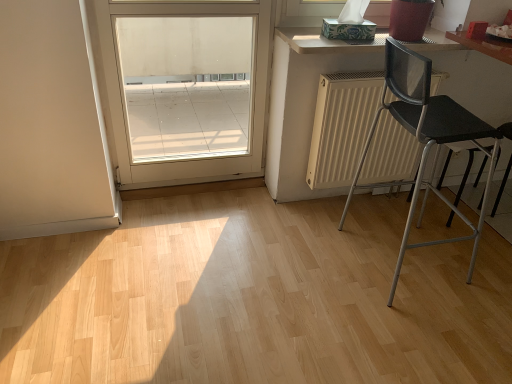
Question: Does light wood countertop at upper right contain black mesh chair at right?

Choices:
 (A) yes
 (B) no

Answer: (B)

Question: From the image's perspective, does light wood countertop at upper right appear higher than black mesh chair at right?

Choices:
 (A) yes
 (B) no

Answer: (A)

Question: Is light wood countertop at upper right oriented away from black mesh chair at right?

Choices:
 (A) no
 (B) yes

Answer: (A)

Question: Considering the relative sizes of light wood countertop at upper right and black mesh chair at right in the image provided, is light wood countertop at upper right bigger than black mesh chair at right?

Choices:
 (A) no
 (B) yes

Answer: (A)

Question: Is light wood countertop at upper right to the right of black mesh chair at right from the viewer's perspective?

Choices:
 (A) no
 (B) yes

Answer: (A)

Question: Based on their sizes in the image, would you say white matte radiator at center is bigger or smaller than black mesh chair at right?

Choices:
 (A) small
 (B) big

Answer: (A)

Question: From their relative heights in the image, would you say white matte radiator at center is taller or shorter than black mesh chair at right?

Choices:
 (A) short
 (B) tall

Answer: (A)

Question: Considering the positions of point pos(335,150) and point pos(479,134), is point pos(335,150) closer or farther from the camera than point pos(479,134)?

Choices:
 (A) farther
 (B) closer

Answer: (A)

Question: From the image's perspective, relative to black mesh chair at right, is white matte radiator at center above or below?

Choices:
 (A) above
 (B) below

Answer: (A)

Question: Considering the positions of light wood countertop at upper right and white matte radiator at center in the image, is light wood countertop at upper right wider or thinner than white matte radiator at center?

Choices:
 (A) wide
 (B) thin

Answer: (A)

Question: From a real-world perspective, relative to white matte radiator at center, is light wood countertop at upper right vertically above or below?

Choices:
 (A) above
 (B) below

Answer: (A)

Question: In terms of size, does light wood countertop at upper right appear bigger or smaller than white matte radiator at center?

Choices:
 (A) small
 (B) big

Answer: (A)

Question: Considering the positions of point (379, 41) and point (381, 112), is point (379, 41) closer or farther from the camera than point (381, 112)?

Choices:
 (A) farther
 (B) closer

Answer: (B)

Question: From a real-world perspective, relative to white matte radiator at center, is black mesh chair at right vertically above or below?

Choices:
 (A) above
 (B) below

Answer: (A)

Question: Is black mesh chair at right in front of or behind white matte radiator at center in the image?

Choices:
 (A) behind
 (B) front

Answer: (B)